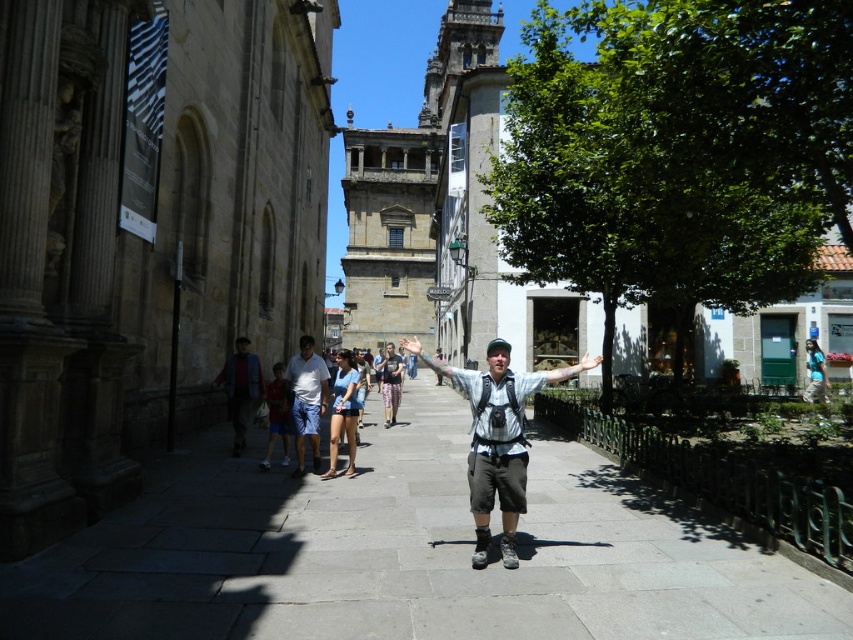
Between gray stone pavement at center and matte red shorts at center, which one has less height?

gray stone pavement at center is shorter.

Between point (357, 557) and point (285, 394), which one is positioned in front?

Point (357, 557) is in front.

Find the location of a particular element. gray stone pavement at center is located at coordinates tap(408, 554).

Does dark gray shorts at center appear under floral pants at center?

Incorrect, dark gray shorts at center is not positioned below floral pants at center.

This screenshot has width=853, height=640. I want to click on dark gray shorts at center, so click(x=497, y=442).

Does point (494, 346) lie in front of point (395, 371)?

Yes, point (494, 346) is closer to viewer.

Locate an element on the screen. The image size is (853, 640). dark gray shorts at center is located at coordinates (497, 442).

Is denim shorts at center shorter than light gray fabric arm at center?

In fact, denim shorts at center may be taller than light gray fabric arm at center.

Which of these two, denim shorts at center or light gray fabric arm at center, stands taller?

With more height is denim shorts at center.

Which is behind, point (225, 365) or point (434, 372)?

The point (434, 372) is more distant.

This screenshot has height=640, width=853. Find the location of `denim shorts at center`. denim shorts at center is located at coordinates (241, 388).